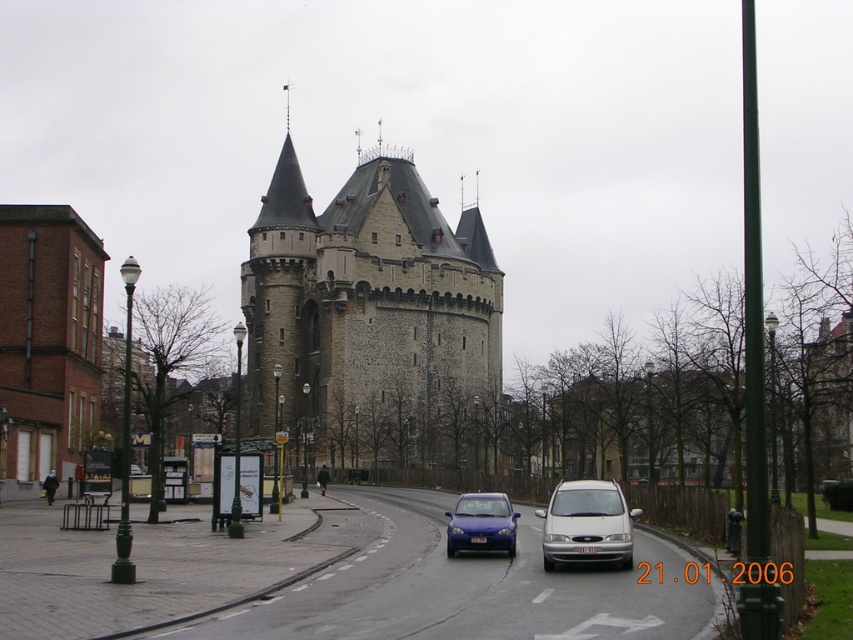
Which is more to the right, silver metallic van at center or matte blue car at center?

silver metallic van at center

Does silver metallic van at center come behind matte blue car at center?

No, it is in front of matte blue car at center.

Locate an element on the screen. silver metallic van at center is located at coordinates (585, 524).

Find the location of a particular element. The width and height of the screenshot is (853, 640). silver metallic van at center is located at coordinates click(585, 524).

Where is `gray stone castle at center`? This screenshot has width=853, height=640. gray stone castle at center is located at coordinates (370, 317).

Can you confirm if gray stone castle at center is taller than matte blue car at center?

Indeed, gray stone castle at center has a greater height compared to matte blue car at center.

Between point (318, 449) and point (466, 509), which one is positioned behind?

The point (318, 449) is behind.

The image size is (853, 640). In order to click on gray stone castle at center in this screenshot , I will do `click(370, 317)`.

Is gray stone castle at center below silver metallic van at center?

No.

Between point (415, 252) and point (550, 544), which one is positioned in front?

Point (550, 544) is in front.

Identify the location of gray stone castle at center. (370, 317).